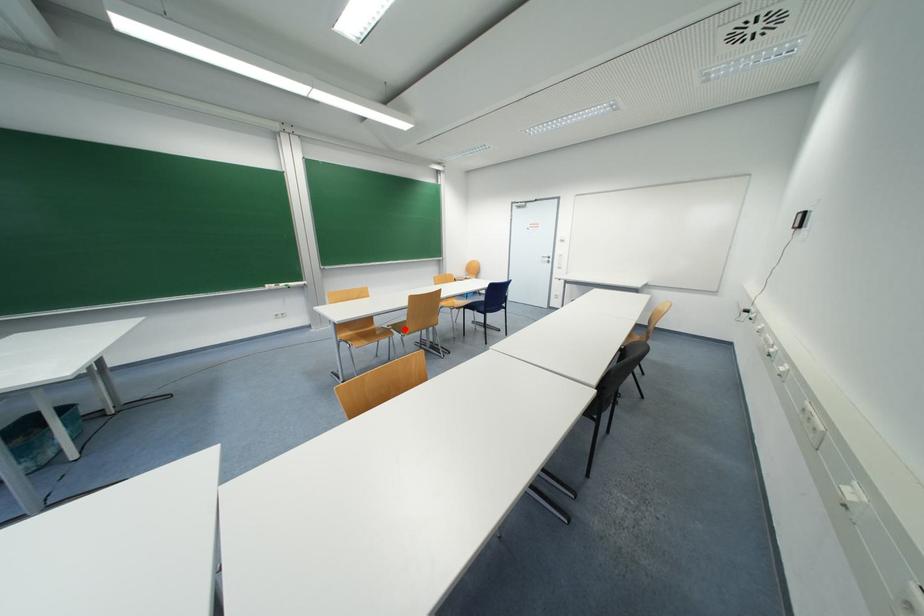
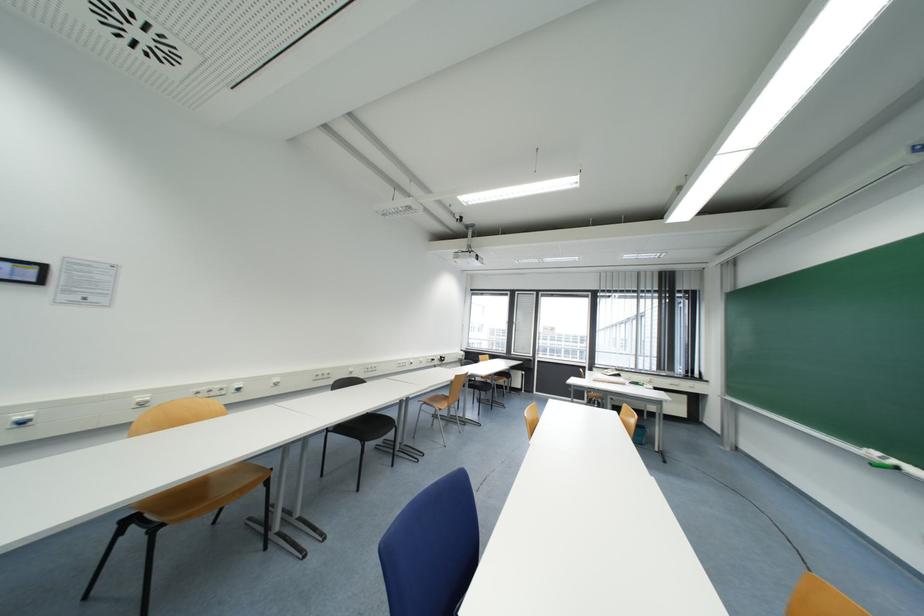
Question: I am providing you with two images of the same scene from different viewpoints. A red point is marked on the first image. At the location where the point appears in image 1, is it still visible in image 2?

Choices:
 (A) Yes
 (B) No

Answer: (B)